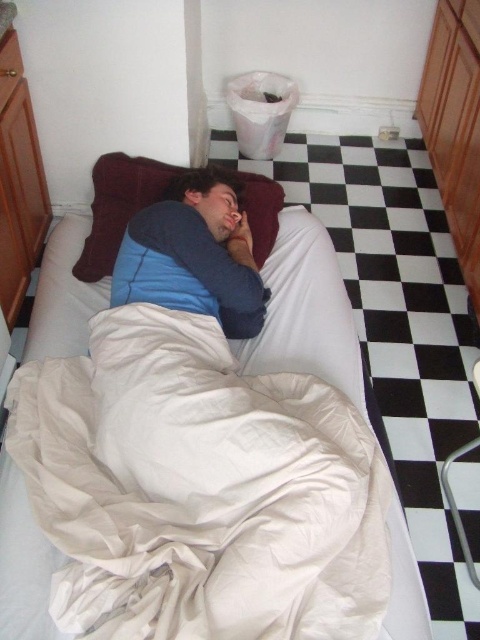
Question: Which point is closer to the camera?

Choices:
 (A) matte blue pillow at center
 (B) white cotton bed at center

Answer: (B)

Question: Can you confirm if white cotton bed at center is bigger than velvet-like brown pillow at center?

Choices:
 (A) yes
 (B) no

Answer: (A)

Question: Among these points, which one is nearest to the camera?

Choices:
 (A) [283, 627]
 (B) [188, 202]

Answer: (A)

Question: Is white cotton bed at center smaller than velvet-like brown pillow at center?

Choices:
 (A) yes
 (B) no

Answer: (B)

Question: Which point appears closest to the camera in this image?

Choices:
 (A) (274, 198)
 (B) (181, 496)
 (C) (190, 193)

Answer: (B)

Question: Is white cotton bed at center positioned at the back of velvet-like brown pillow at center?

Choices:
 (A) no
 (B) yes

Answer: (A)